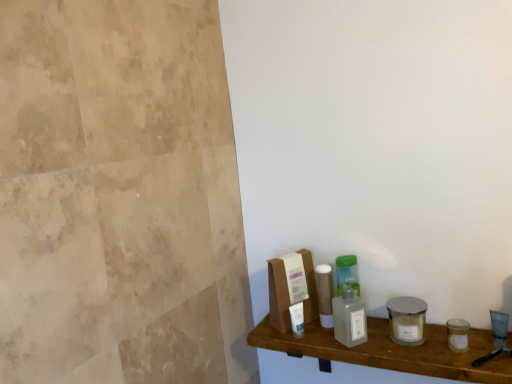
Image resolution: width=512 pixels, height=384 pixels. What do you see at coordinates (390, 351) in the screenshot? I see `translucent plastic bottles at center` at bounding box center [390, 351].

The image size is (512, 384). In order to click on translucent plastic bottles at center in this screenshot , I will do `click(390, 351)`.

This screenshot has width=512, height=384. What are the coordinates of `transparent plastic bottle at center` in the screenshot? It's located at (349, 318).

Image resolution: width=512 pixels, height=384 pixels. What do you see at coordinates (349, 318) in the screenshot?
I see `transparent plastic bottle at center` at bounding box center [349, 318].

Identify the location of translucent plastic bottles at center. (390, 351).

Considering the relative positions of transparent plastic bottle at center and translucent plastic bottles at center in the image provided, is transparent plastic bottle at center to the left or to the right of translucent plastic bottles at center?

Clearly, transparent plastic bottle at center is on the left of translucent plastic bottles at center in the image.

Is transparent plastic bottle at center further to the viewer compared to translucent plastic bottles at center?

Yes, transparent plastic bottle at center is behind translucent plastic bottles at center.

Between point (351, 332) and point (382, 359), which one is positioned in front?

Positioned in front is point (382, 359).

From the image's perspective, is transparent plastic bottle at center located beneath translucent plastic bottles at center?

No.

From a real-world perspective, is transparent plastic bottle at center physically above translucent plastic bottles at center?

Yes, from a real-world perspective, transparent plastic bottle at center is over translucent plastic bottles at center

Between transparent plastic bottle at center and translucent plastic bottles at center, which one has larger width?

With larger width is translucent plastic bottles at center.

Does transparent plastic bottle at center have a lesser height compared to translucent plastic bottles at center?

Yes.

Which of these two, transparent plastic bottle at center or translucent plastic bottles at center, is smaller?

Smaller between the two is transparent plastic bottle at center.

Is transparent plastic bottle at center completely or partially outside of translucent plastic bottles at center?

Indeed, transparent plastic bottle at center is completely outside translucent plastic bottles at center.

Are transparent plastic bottle at center and translucent plastic bottles at center making contact?

There is a gap between transparent plastic bottle at center and translucent plastic bottles at center.

Is transparent plastic bottle at center turned away from translucent plastic bottles at center?

No, transparent plastic bottle at center is not facing the opposite direction of translucent plastic bottles at center.

Where is `shelf below the transparent plastic bottle at center (from the image's perspective)`? This screenshot has height=384, width=512. shelf below the transparent plastic bottle at center (from the image's perspective) is located at coordinates (390, 351).

Which object is positioned more to the right, translucent plastic bottles at center or transparent plastic bottle at center?

translucent plastic bottles at center.

Does translucent plastic bottles at center come in front of transparent plastic bottle at center?

Yes.

Is point (381, 357) positioned behind point (360, 308)?

No, (381, 357) is closer to viewer.

From the image's perspective, is translucent plastic bottles at center positioned above or below transparent plastic bottle at center?

Clearly, from the image's perspective, translucent plastic bottles at center is below transparent plastic bottle at center.

From a real-world perspective, which object stands above the other?

transparent plastic bottle at center is physically above.

In terms of width, does translucent plastic bottles at center look wider or thinner when compared to transparent plastic bottle at center?

In the image, translucent plastic bottles at center appears to be wider than transparent plastic bottle at center.

Considering the relative sizes of translucent plastic bottles at center and transparent plastic bottle at center in the image provided, is translucent plastic bottles at center shorter than transparent plastic bottle at center?

In fact, translucent plastic bottles at center may be taller than transparent plastic bottle at center.

Which of these two, translucent plastic bottles at center or transparent plastic bottle at center, is smaller?

With smaller size is transparent plastic bottle at center.

Is translucent plastic bottles at center spatially inside transparent plastic bottle at center, or outside of it?

translucent plastic bottles at center lies outside transparent plastic bottle at center.

Based on the photo, can you see translucent plastic bottles at center touching transparent plastic bottle at center?

No, translucent plastic bottles at center is not next to transparent plastic bottle at center.

Could you tell me if translucent plastic bottles at center is turned towards transparent plastic bottle at center?

No, translucent plastic bottles at center is not oriented towards transparent plastic bottle at center.

Can you tell me how much translucent plastic bottles at center and transparent plastic bottle at center differ in facing direction?

The angular difference between translucent plastic bottles at center and transparent plastic bottle at center is 52 degrees.

Locate an element on the screen. This screenshot has height=384, width=512. cleaning product behind the translucent plastic bottles at center is located at coordinates (349, 318).

Find the location of a particular element. The height and width of the screenshot is (384, 512). cleaning product behind the translucent plastic bottles at center is located at coordinates (349, 318).

The image size is (512, 384). Find the location of `shelf that is below the transparent plastic bottle at center (from the image's perspective)`. shelf that is below the transparent plastic bottle at center (from the image's perspective) is located at coordinates (390, 351).